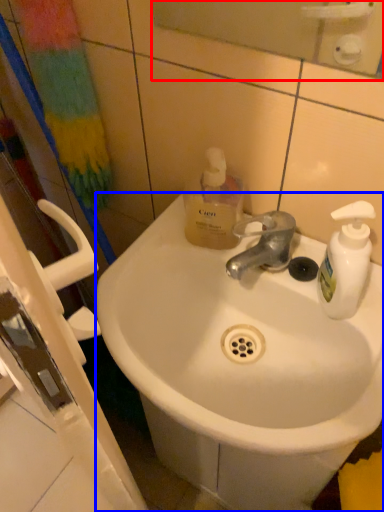
Question: Which of the following is the closest to the observer, mirror (highlighted by a red box) or sink (highlighted by a blue box)?

Choices:
 (A) mirror
 (B) sink

Answer: (A)